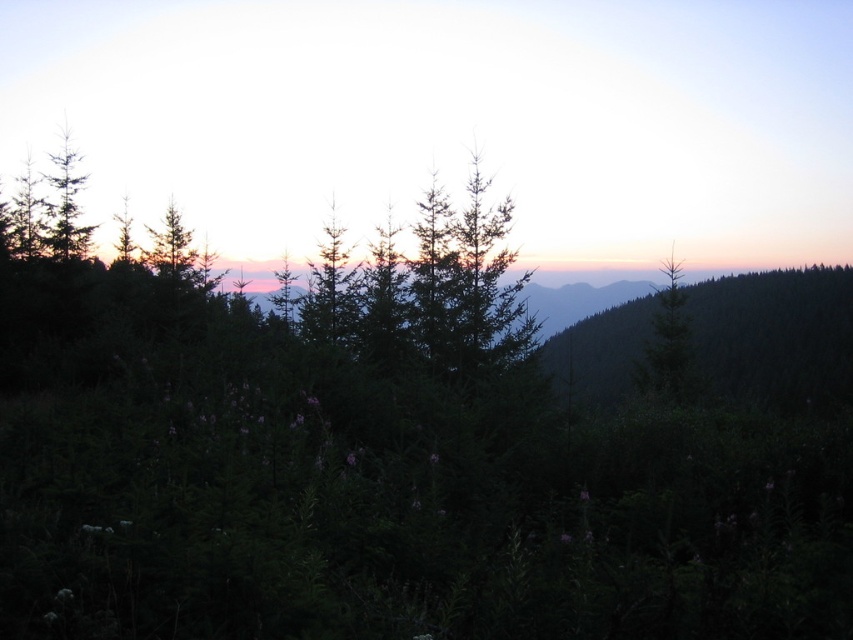
You are standing at the camera position and want to take a photo of the silhouetted evergreen trees at upper center. If your camera has a maximum focusing distance of 400 feet, will it be able to focus on the trees?

The silhouetted evergreen trees at upper center are 444.35 feet away from the camera, which exceeds the maximum focusing distance of 400 feet. Therefore, the camera will not be able to focus on the trees.

You are an artist sketching this landscape. You want to place the sun in the image such that it is positioned exactly to the right of the silhouetted evergreen trees at upper center. Given their 2D coordinates, where should you place the sun?

The silhouetted evergreen trees at upper center are located at coordinates point (453, 120). To place the sun exactly to the right of them, you should position it at a point with the same y coordinate of 0.532 and a higher x coordinate than 0.188, such as 0.25 or 0.3, depending on the desired distance.